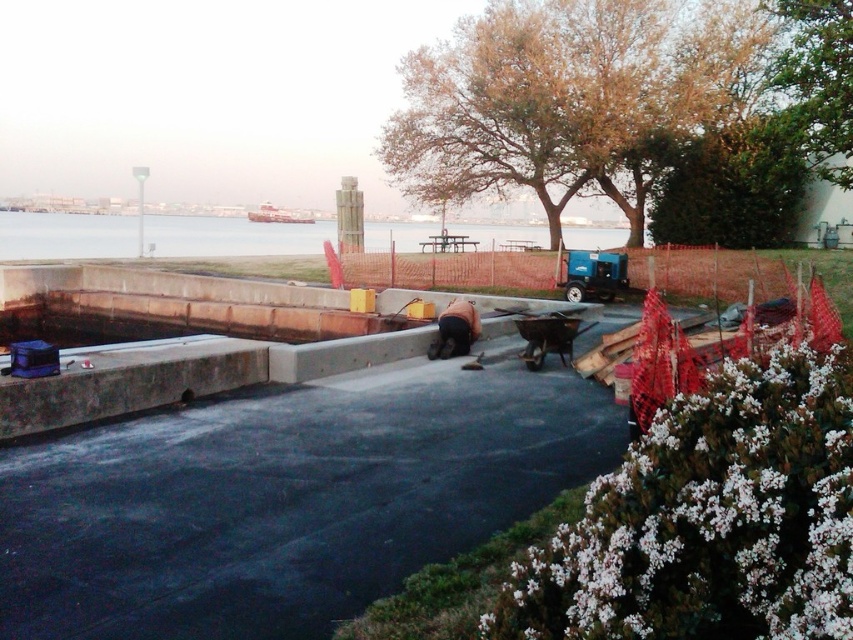
Can you confirm if clear water at center is bigger than dark brown leather jacket at center?

Yes.

Is point (4, 218) in front of point (430, 358)?

That is False.

Image resolution: width=853 pixels, height=640 pixels. In order to click on clear water at center in this screenshot , I will do `click(231, 236)`.

Does point (422, 488) come in front of point (843, 140)?

Yes, it is.

Which is below, black asphalt pavement at center or green leafy tree at upper right?

black asphalt pavement at center is below.

Where is `black asphalt pavement at center`? Image resolution: width=853 pixels, height=640 pixels. black asphalt pavement at center is located at coordinates (285, 497).

Is brown leafy tree at upper center in front of dark brown leather jacket at center?

No.

Does point (595, 150) lie behind point (466, 348)?

Yes, point (595, 150) is farther from viewer.

Where is `brown leafy tree at upper center`? The image size is (853, 640). brown leafy tree at upper center is located at coordinates (572, 99).